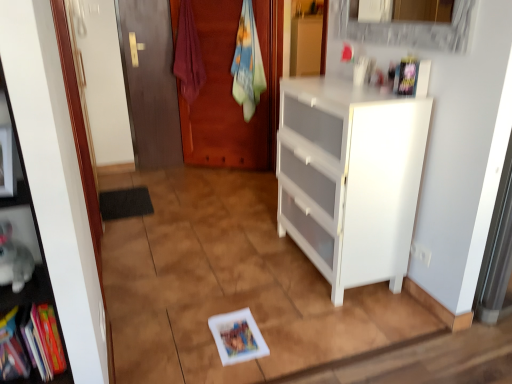
You are a GUI agent. You are given a task and a screenshot of the screen. Output one action in this format:
    pyautogui.click(x=<x>, y=<y>)
    Task: Click on the vacant position to the left of matte purple book at upper right, which ranks as the fourth book in left-to-right order
    The image size is (512, 384).
    Given the screenshot: What is the action you would take?
    pyautogui.click(x=374, y=96)